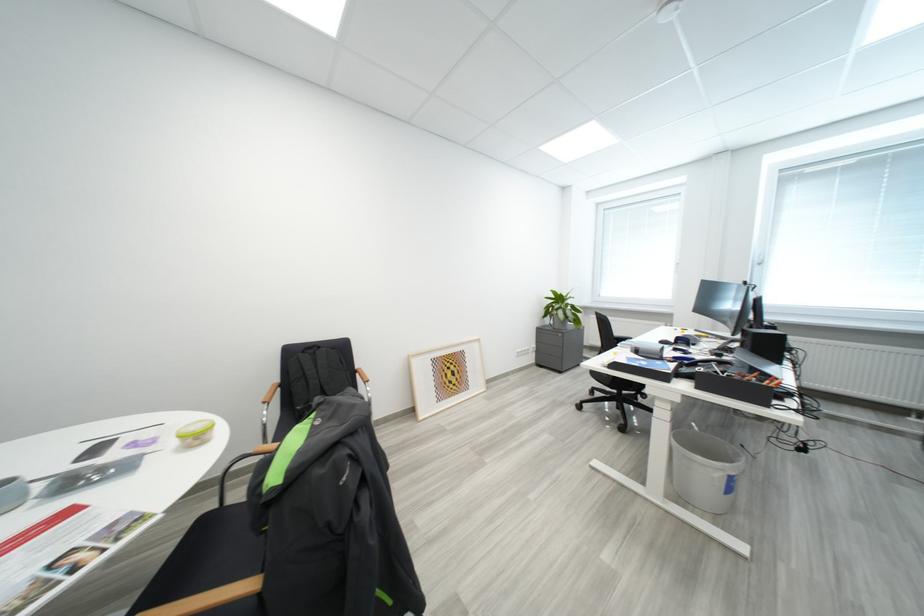
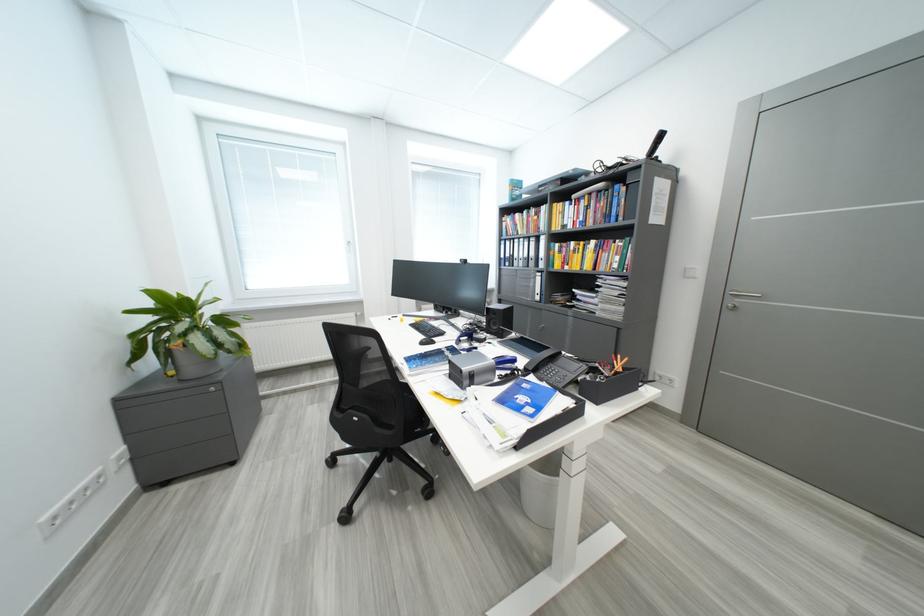
In the second image, find the point that corresponds to point (646, 354) in the first image.

(481, 381)